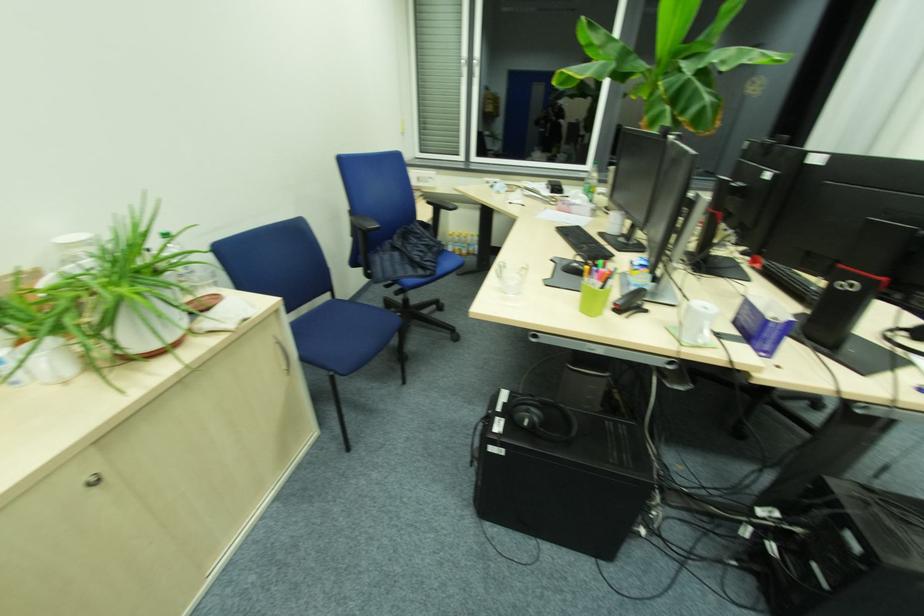
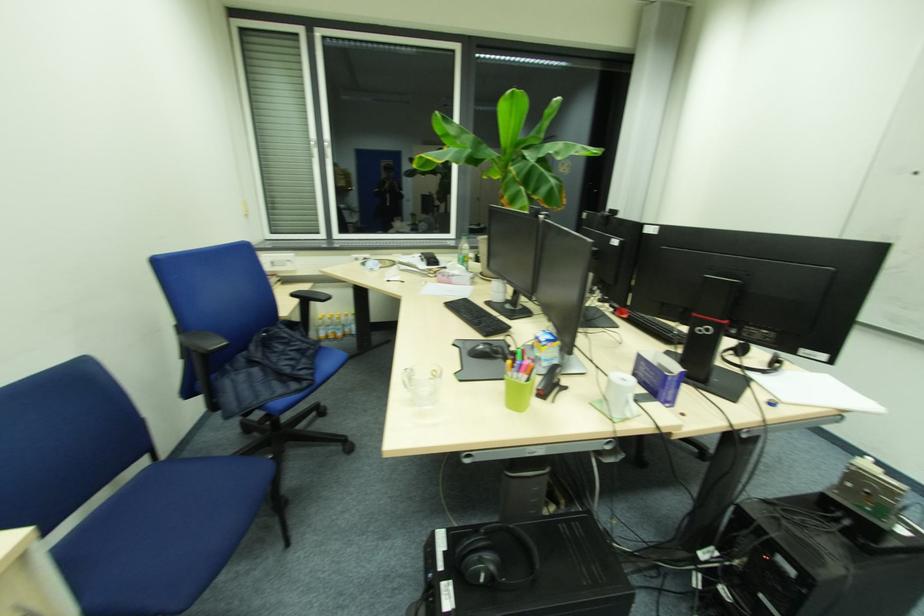
Question: Which direction would the cameraman need to move to produce the second image? Reply with the corresponding letter.

Choices:
 (A) Left
 (B) Right
 (C) Forward
 (D) Backward

Answer: (C)